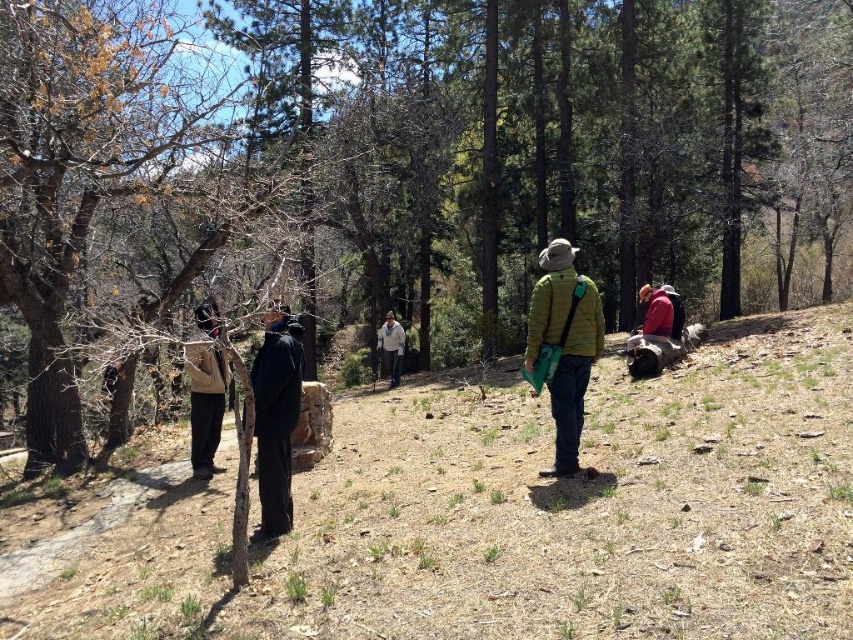
Question: Does green matte jacket at center appear over light beige sweater at center?

Choices:
 (A) no
 (B) yes

Answer: (A)

Question: Which of the following is the closest to the observer?

Choices:
 (A) light beige sweater at center
 (B) red woolen sweater at center
 (C) black matte jacket at center

Answer: (C)

Question: Which of these objects is positioned closest to the green matte jacket at center?

Choices:
 (A) beige fabric jacket at left
 (B) light beige sweater at center
 (C) brown dirt ground at center

Answer: (C)

Question: Among these objects, which one is farthest from the camera?

Choices:
 (A) light beige sweater at center
 (B) green matte jacket at center
 (C) red woolen sweater at center

Answer: (A)

Question: Is brown dirt ground at center wider than green matte jacket at center?

Choices:
 (A) yes
 (B) no

Answer: (A)

Question: Can you confirm if brown dirt ground at center is thinner than black matte jacket at center?

Choices:
 (A) yes
 (B) no

Answer: (B)